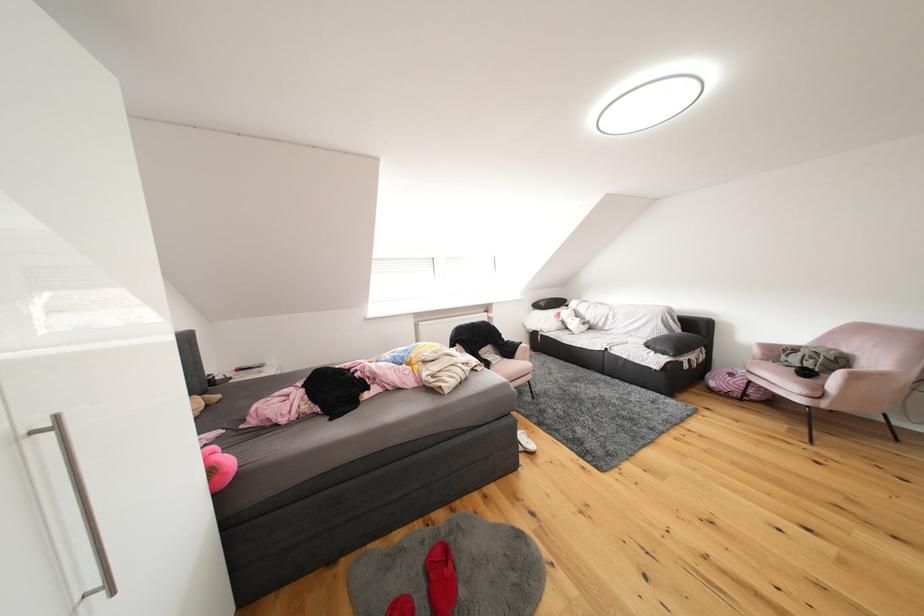
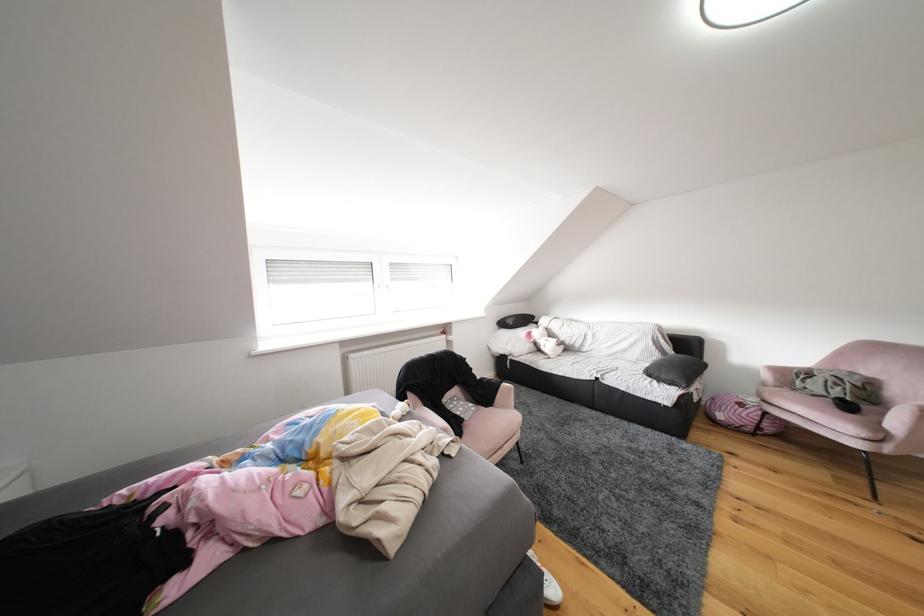
Question: The images are taken continuously from a first-person perspective. In which direction is your viewpoint rotating?

Choices:
 (A) Left
 (B) Right
 (C) Up
 (D) Down

Answer: (B)